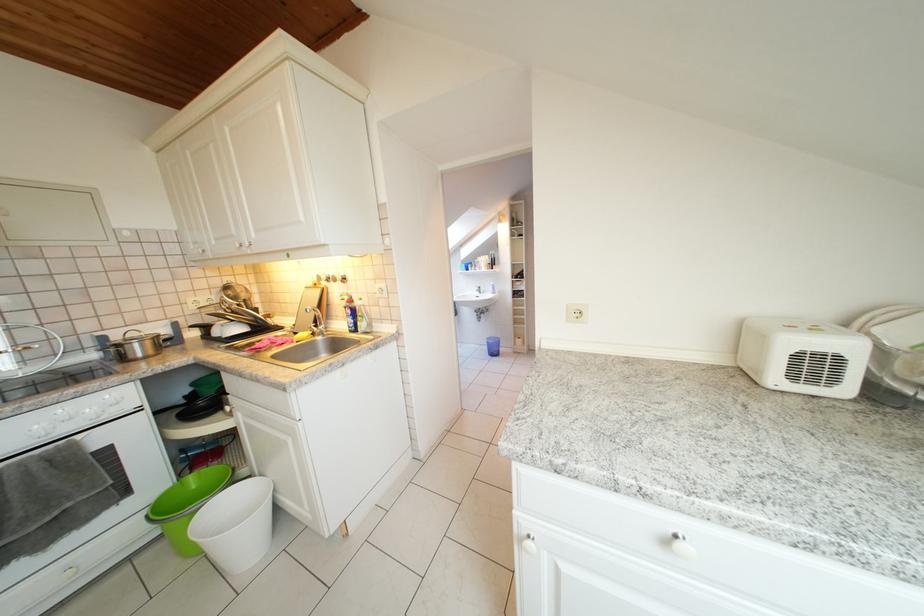
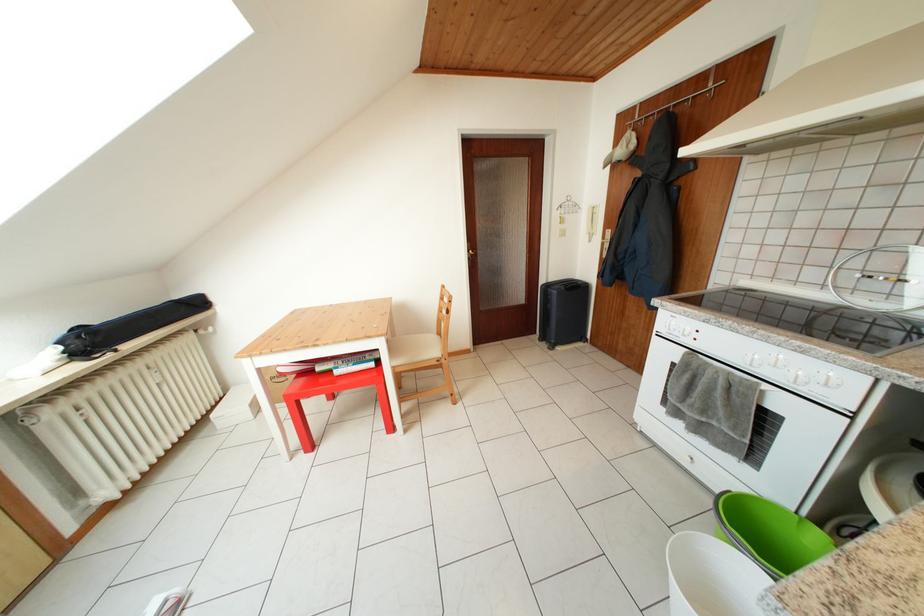
In the second image, find the point that corresponds to (x=119, y=519) in the first image.

(738, 467)